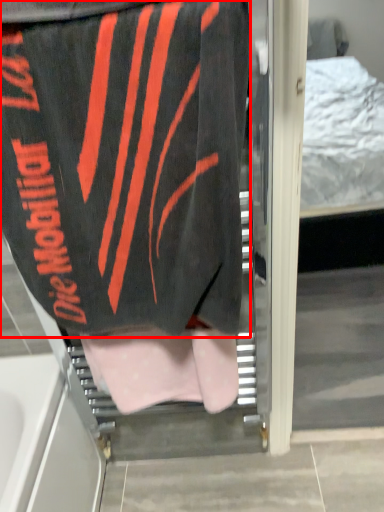
Question: Observing the image, what is the correct spatial positioning of towel (annotated by the red box) in reference to underclothes?

Choices:
 (A) left
 (B) right

Answer: (A)